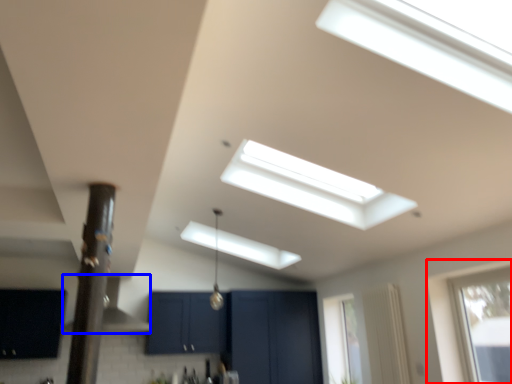
Question: Among these objects, which one is farthest to the camera, window (highlighted by a red box) or exhaust hood (highlighted by a blue box)?

Choices:
 (A) window
 (B) exhaust hood

Answer: (B)